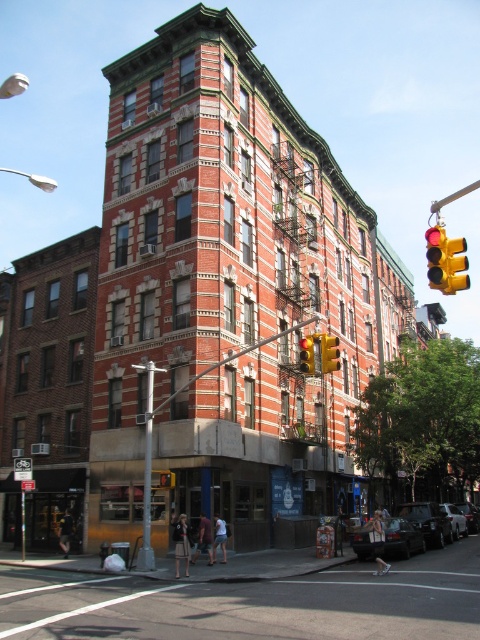
Question: Which object is positioned farthest from the yellow matte traffic light at upper right?

Choices:
 (A) yellow plastic traffic light at center
 (B) yellow metallic traffic light at upper right

Answer: (B)

Question: Can you confirm if yellow metallic traffic light at upper right is thinner than yellow matte traffic light at upper right?

Choices:
 (A) no
 (B) yes

Answer: (A)

Question: Is yellow plastic traffic light at center to the right of yellow matte traffic light at upper right from the viewer's perspective?

Choices:
 (A) no
 (B) yes

Answer: (B)

Question: Which object appears farthest from the camera in this image?

Choices:
 (A) yellow matte traffic light at upper right
 (B) yellow metallic traffic light at upper right
 (C) yellow plastic traffic light at center
 (D) yellow plastic traffic light at upper right

Answer: (A)

Question: Among these objects, which one is farthest from the camera?

Choices:
 (A) yellow plastic traffic light at upper right
 (B) yellow plastic traffic light at center
 (C) yellow matte traffic light at upper right

Answer: (C)

Question: Can you confirm if yellow metallic traffic light at upper right is positioned to the left of yellow matte traffic light at upper right?

Choices:
 (A) yes
 (B) no

Answer: (B)